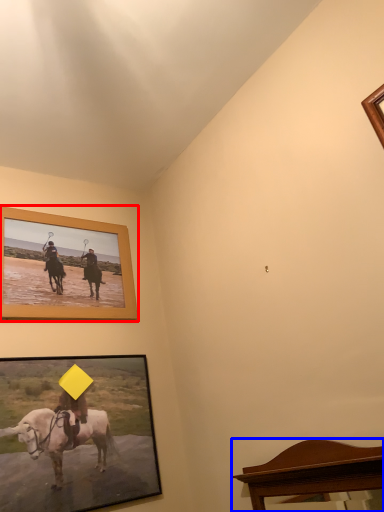
Question: Which object is further to the camera taking this photo, picture frame (highlighted by a red box) or furniture (highlighted by a blue box)?

Choices:
 (A) picture frame
 (B) furniture

Answer: (A)